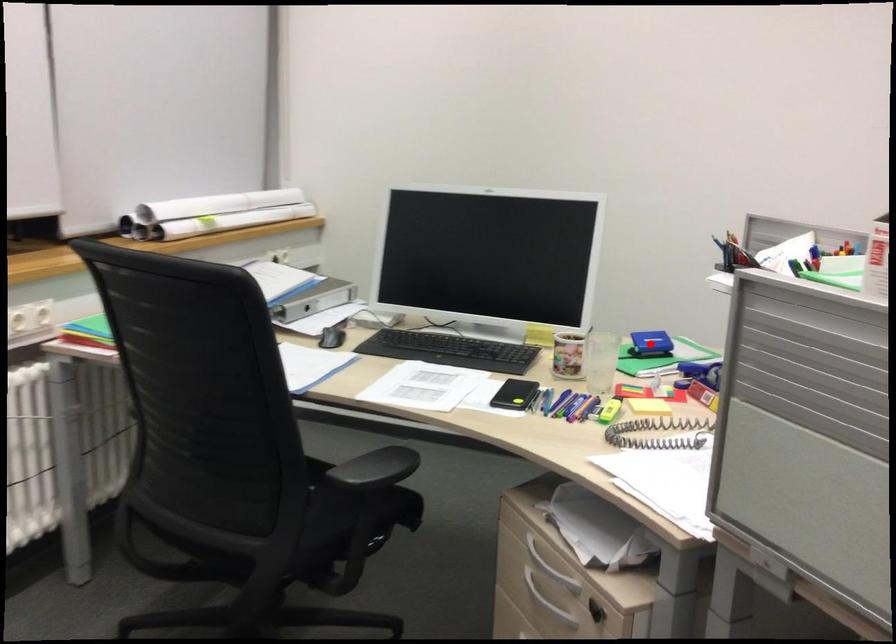
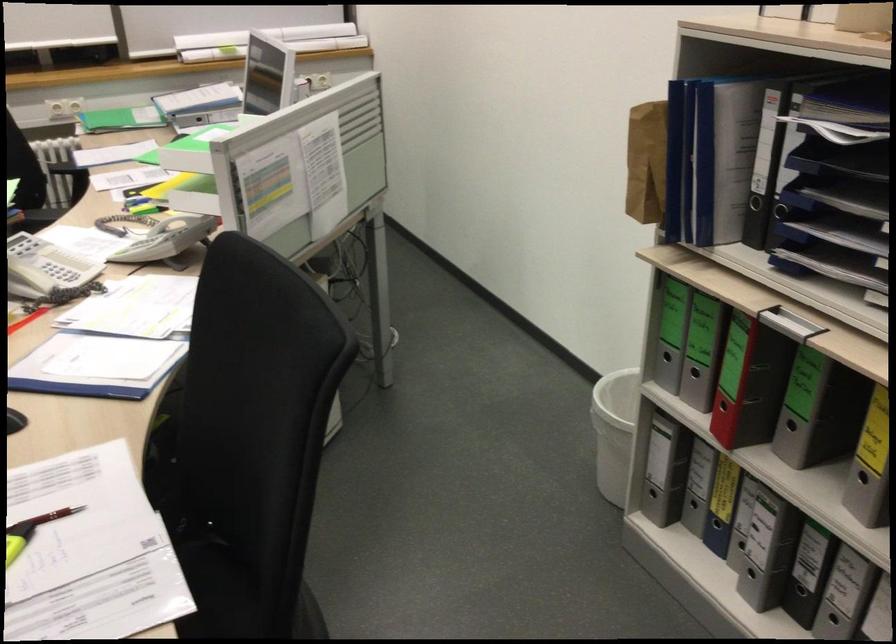
Question: I am providing you with two images of the same scene from different viewpoints. A red point is marked on the first image. Can you still see the location of the red point in image 2?

Choices:
 (A) Yes
 (B) No

Answer: (B)